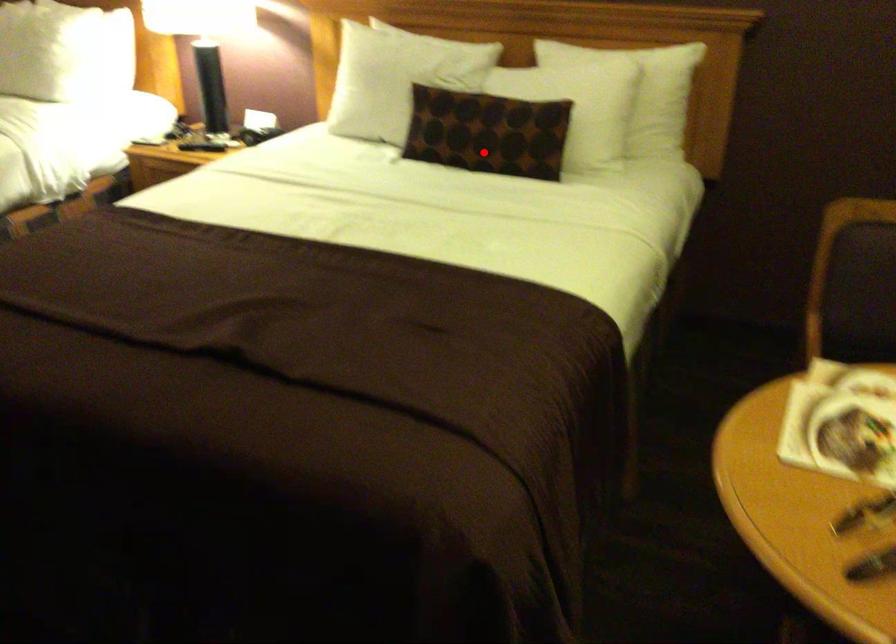
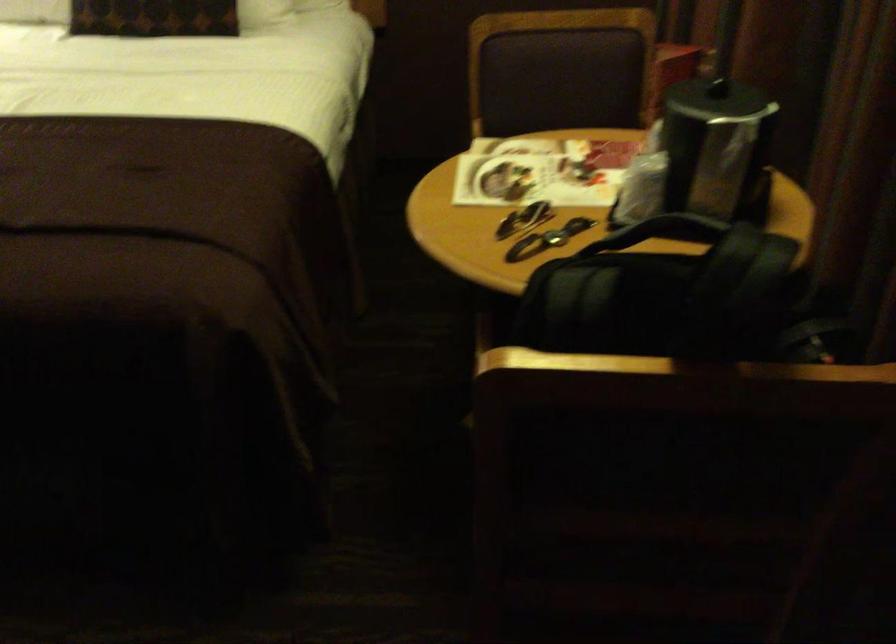
Where in the second image is the point corresponding to the highlighted location from the first image?

(152, 17)